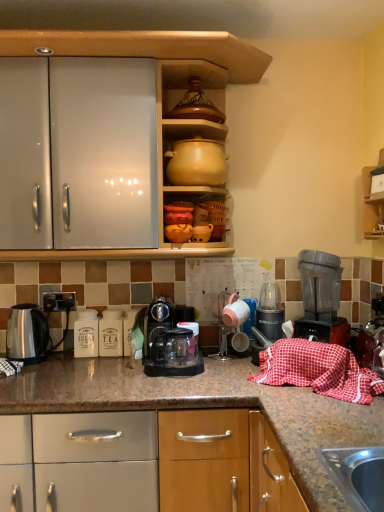
You are a GUI agent. You are given a task and a screenshot of the screen. Output one action in this format:
    pyautogui.click(x=<x>, y=<y>)
    Task: Click on the transparent plastic coffee maker at center, the second kitchen appliance when ordered from right to left
    
    Given the screenshot: What is the action you would take?
    pyautogui.click(x=169, y=345)

Describe the element at coordinates (270, 312) in the screenshot. I see `metallic plastic blender at center, which is the 1th kitchen appliance from right to left` at that location.

Identify the location of transparent plastic coffee maker at center, the second kitchen appliance when ordered from right to left. (169, 345).

From their relative heights in the image, would you say metallic plastic blender at center, which is the 1th kitchen appliance from right to left, is taller or shorter than satin silver kettle at left, the third kitchen appliance viewed from the right?

Considering their sizes, metallic plastic blender at center, which is the 1th kitchen appliance from right to left, has more height than satin silver kettle at left, the third kitchen appliance viewed from the right.

Can you see metallic plastic blender at center, which ranks as the 3th kitchen appliance in left-to-right order, touching satin silver kettle at left, the third kitchen appliance viewed from the right?

No.

Is point (274, 339) closer or farther from the camera than point (44, 330)?

Clearly, point (274, 339) is closer to the camera than point (44, 330).

Is satin silver kettle at left, marked as the first kitchen appliance in a left-to-right arrangement, completely or partially outside of black plastic electric outlet at lower left?

satin silver kettle at left, marked as the first kitchen appliance in a left-to-right arrangement, is positioned outside black plastic electric outlet at lower left.

Is satin silver kettle at left, marked as the first kitchen appliance in a left-to-right arrangement, positioned behind black plastic electric outlet at lower left?

No, satin silver kettle at left, marked as the first kitchen appliance in a left-to-right arrangement, is closer to the camera.

Does point (22, 319) come farther from viewer compared to point (58, 300)?

No, (22, 319) is in front of (58, 300).

From the image's perspective, starting from the black plastic electric outlet at lower left, which kitchen appliance is the 3rd one below? Please provide its 2D coordinates.

[(26, 333)]

Considering the sizes of objects satin silver kettle at left, marked as the first kitchen appliance in a left-to-right arrangement, and transparent plastic blender at right in the image provided, who is thinner, satin silver kettle at left, marked as the first kitchen appliance in a left-to-right arrangement, or transparent plastic blender at right?

With smaller width is satin silver kettle at left, marked as the first kitchen appliance in a left-to-right arrangement.

Which of these two, satin silver kettle at left, marked as the first kitchen appliance in a left-to-right arrangement, or transparent plastic blender at right, stands shorter?

With less height is satin silver kettle at left, marked as the first kitchen appliance in a left-to-right arrangement.

Based on the photo, how much distance is there between black plastic electric outlet at lower left and transparent plastic coffee maker at center, the 2th kitchen appliance in the left-to-right sequence?

They are 19.14 inches apart.

Can you tell me how much black plastic electric outlet at lower left and transparent plastic coffee maker at center, the 2th kitchen appliance in the left-to-right sequence, differ in facing direction?

black plastic electric outlet at lower left and transparent plastic coffee maker at center, the 2th kitchen appliance in the left-to-right sequence, are facing 0.506 degrees away from each other.

Is black plastic electric outlet at lower left wider or thinner than transparent plastic coffee maker at center, the 2th kitchen appliance in the left-to-right sequence?

Considering their sizes, black plastic electric outlet at lower left looks slimmer than transparent plastic coffee maker at center, the 2th kitchen appliance in the left-to-right sequence.

Does black plastic electric outlet at lower left have a larger size compared to transparent plastic coffee maker at center, the 2th kitchen appliance in the left-to-right sequence?

Incorrect, black plastic electric outlet at lower left is not larger than transparent plastic coffee maker at center, the 2th kitchen appliance in the left-to-right sequence.

From the picture: From a real-world perspective, does red checkered cloth at lower right stand above matte yellow clay pot at upper center?

Actually, red checkered cloth at lower right is physically below matte yellow clay pot at upper center in the real world.

Considering the sizes of red checkered cloth at lower right and matte yellow clay pot at upper center in the image, is red checkered cloth at lower right bigger or smaller than matte yellow clay pot at upper center?

In the image, red checkered cloth at lower right appears to be larger than matte yellow clay pot at upper center.

Based on the photo, could you tell me if red checkered cloth at lower right is facing matte yellow clay pot at upper center?

No.

Which is more to the right, red checkered cloth at lower right or matte yellow clay pot at upper center?

Positioned to the right is red checkered cloth at lower right.

From a real-world perspective, is transparent plastic blender at right below transparent plastic coffee maker at center, the second kitchen appliance when ordered from right to left?

Actually, transparent plastic blender at right is physically above transparent plastic coffee maker at center, the second kitchen appliance when ordered from right to left, in the real world.

Considering the relative positions of transparent plastic blender at right and transparent plastic coffee maker at center, the second kitchen appliance when ordered from right to left, in the image provided, is transparent plastic blender at right in front of transparent plastic coffee maker at center, the second kitchen appliance when ordered from right to left,?

No, it is not.

The height and width of the screenshot is (512, 384). What are the coordinates of `home appliance behind the transparent plastic coffee maker at center, the second kitchen appliance when ordered from right to left` in the screenshot? It's located at (321, 298).

Is transparent plastic blender at right bigger than transparent plastic coffee maker at center, the 2th kitchen appliance in the left-to-right sequence?

Indeed, transparent plastic blender at right has a larger size compared to transparent plastic coffee maker at center, the 2th kitchen appliance in the left-to-right sequence.

Does metallic plastic blender at center, which ranks as the 3th kitchen appliance in left-to-right order, come behind black plastic electric outlet at lower left?

No.

I want to click on electric outlet positioned vertically above the metallic plastic blender at center, which is the 1th kitchen appliance from right to left (from a real-world perspective), so click(59, 301).

Does metallic plastic blender at center, which is the 1th kitchen appliance from right to left, have a larger size compared to black plastic electric outlet at lower left?

Indeed, metallic plastic blender at center, which is the 1th kitchen appliance from right to left, has a larger size compared to black plastic electric outlet at lower left.

The width and height of the screenshot is (384, 512). Identify the location of the 2nd kitchen appliance to the right when counting from the satin silver kettle at left, marked as the first kitchen appliance in a left-to-right arrangement. (270, 312).

Image resolution: width=384 pixels, height=512 pixels. Find the location of `electric outlet positioned vertically above the satin silver kettle at left, marked as the first kitchen appliance in a left-to-right arrangement (from a real-world perspective)`. electric outlet positioned vertically above the satin silver kettle at left, marked as the first kitchen appliance in a left-to-right arrangement (from a real-world perspective) is located at coordinates (59, 301).

Considering their positions, is transparent plastic coffee maker at center, the 2th kitchen appliance in the left-to-right sequence, positioned further to transparent plastic blender at right than black plastic electric outlet at lower left?

The object further to transparent plastic blender at right is black plastic electric outlet at lower left.

Which object lies nearer to the anchor point matte yellow clay pot at upper center, transparent plastic blender at right or metallic plastic blender at center, which ranks as the 3th kitchen appliance in left-to-right order?

transparent plastic blender at right.

In the scene shown: Estimate the real-world distances between objects in this image. Which object is further from transparent plastic coffee maker at center, the second kitchen appliance when ordered from right to left, satin silver kettle at left, the third kitchen appliance viewed from the right, or matte yellow clay pot at upper center?

The object further to transparent plastic coffee maker at center, the second kitchen appliance when ordered from right to left, is matte yellow clay pot at upper center.

Looking at the image, which one is located further to transparent plastic coffee maker at center, the 2th kitchen appliance in the left-to-right sequence, satin silver kettle at left, the third kitchen appliance viewed from the right, or red checkered cloth at lower right?

The object further to transparent plastic coffee maker at center, the 2th kitchen appliance in the left-to-right sequence, is satin silver kettle at left, the third kitchen appliance viewed from the right.

Which object lies further to the anchor point black plastic electric outlet at lower left, satin silver kettle at left, the third kitchen appliance viewed from the right, or transparent plastic blender at right?

The object further to black plastic electric outlet at lower left is transparent plastic blender at right.

Estimate the real-world distances between objects in this image. Which object is further from transparent plastic blender at right, transparent plastic coffee maker at center, the second kitchen appliance when ordered from right to left, or metallic plastic blender at center, which ranks as the 3th kitchen appliance in left-to-right order?

transparent plastic coffee maker at center, the second kitchen appliance when ordered from right to left, is positioned further to the anchor transparent plastic blender at right.

From the picture: Looking at the image, which one is located closer to matte yellow clay pot at upper center, satin silver kettle at left, the third kitchen appliance viewed from the right, or transparent plastic blender at right?

transparent plastic blender at right lies closer to matte yellow clay pot at upper center than the other object.

Considering their positions, is matte yellow clay pot at upper center positioned closer to transparent plastic blender at right than transparent plastic coffee maker at center, the second kitchen appliance when ordered from right to left?

The object closer to transparent plastic blender at right is transparent plastic coffee maker at center, the second kitchen appliance when ordered from right to left.

At what (x,y) coordinates should I click in order to perform the action: click on coffeepot between satin silver kettle at left, marked as the first kitchen appliance in a left-to-right arrangement, and metallic plastic blender at center, which ranks as the 3th kitchen appliance in left-to-right order, in the horizontal direction. Please return your answer as a coordinate pair (x, y). Image resolution: width=384 pixels, height=512 pixels. Looking at the image, I should click on (197, 163).

Image resolution: width=384 pixels, height=512 pixels. I want to click on home appliance between matte yellow clay pot at upper center and transparent plastic coffee maker at center, the 2th kitchen appliance in the left-to-right sequence, from top to bottom, so click(x=321, y=298).

Find the location of a particular element. The image size is (384, 512). home appliance between red checkered cloth at lower right and metallic plastic blender at center, which ranks as the 3th kitchen appliance in left-to-right order, from front to back is located at coordinates (321, 298).

The height and width of the screenshot is (512, 384). Identify the location of kitchen appliance between black plastic electric outlet at lower left and metallic plastic blender at center, which ranks as the 3th kitchen appliance in left-to-right order, from left to right. (169, 345).